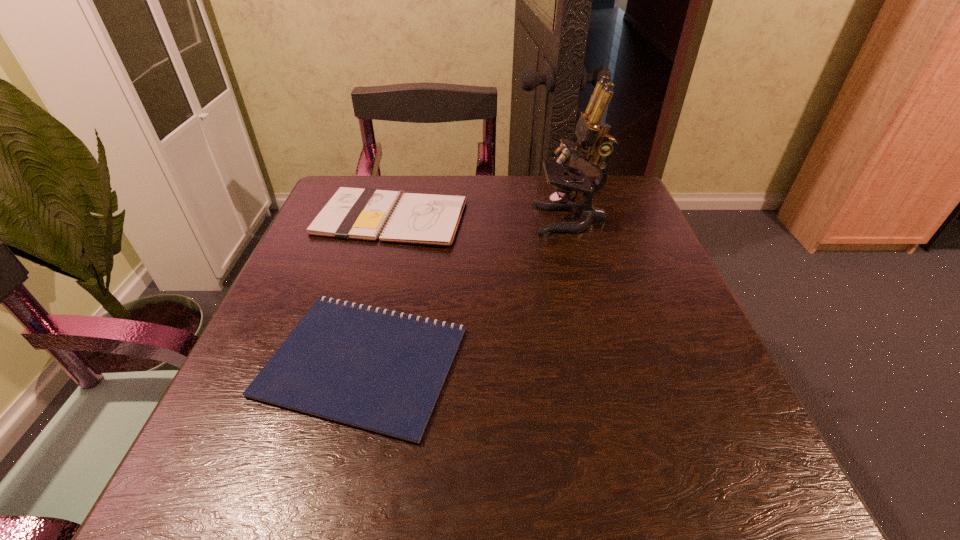
I want to click on vacant area situated 0.360m on the right of the shorter notepad, so click(684, 361).

You are a GUI agent. You are given a task and a screenshot of the screen. Output one action in this format:
    pyautogui.click(x=<x>, y=<y>)
    Task: Click on the microscope that is at the far edge
    
    Given the screenshot: What is the action you would take?
    pyautogui.click(x=593, y=139)

The height and width of the screenshot is (540, 960). I want to click on notepad that is at the far edge, so click(x=367, y=214).

The width and height of the screenshot is (960, 540). In order to click on object that is at the near edge in this screenshot , I will do `click(382, 371)`.

Identify the location of object that is at the right edge. (593, 139).

Identify the location of object at the far left corner. (367, 214).

The image size is (960, 540). What are the coordinates of `object that is at the near left corner` in the screenshot? It's located at (382, 371).

The width and height of the screenshot is (960, 540). I want to click on object located in the far right corner section of the desktop, so click(x=593, y=139).

The image size is (960, 540). I want to click on free space at the far edge, so pyautogui.click(x=548, y=200).

Image resolution: width=960 pixels, height=540 pixels. In the image, there is a desktop. Find the location of `free region at the near edge`. free region at the near edge is located at coordinates (501, 507).